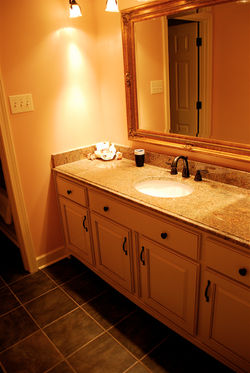
Where is `door hinges`? This screenshot has height=373, width=250. door hinges is located at coordinates (199, 41), (196, 103).